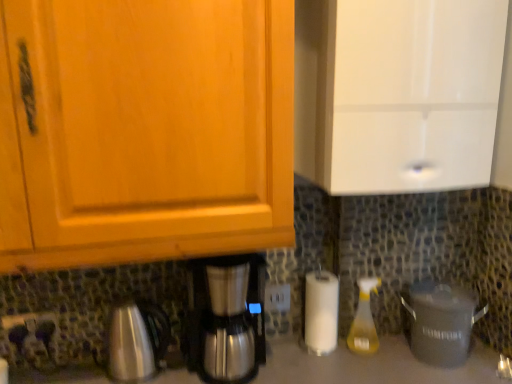
Question: From a real-world perspective, is yellow translucent spray bottle at lower right physically located above or below gray matte crock pot at lower right?

Choices:
 (A) below
 (B) above

Answer: (B)

Question: Is yellow translucent spray bottle at lower right taller or shorter than gray matte crock pot at lower right?

Choices:
 (A) short
 (B) tall

Answer: (B)

Question: Which object is the farthest from the satin silver coffee maker at lower center?

Choices:
 (A) gray matte crock pot at lower right
 (B) metallic silver power plugs and sockets at lower left, the 1th power plugs and sockets positioned from the left
 (C) white plastic power plugs and sockets at center, positioned as the second power plugs and sockets in left-to-right order
 (D) white glossy cabinet at upper right
 (E) matte black outlet at lower center

Answer: (D)

Question: Considering the real-world distances, which object is closest to the yellow translucent spray bottle at lower right?

Choices:
 (A) white plastic power plugs and sockets at center, which ranks as the 2th power plugs and sockets in front-to-back order
 (B) gray matte crock pot at lower right
 (C) matte black outlet at lower center
 (D) satin silver coffee maker at lower center
 (E) metallic silver power plugs and sockets at lower left, the 2th power plugs and sockets viewed from the right

Answer: (B)